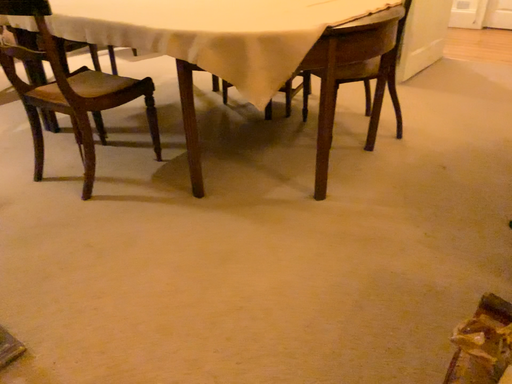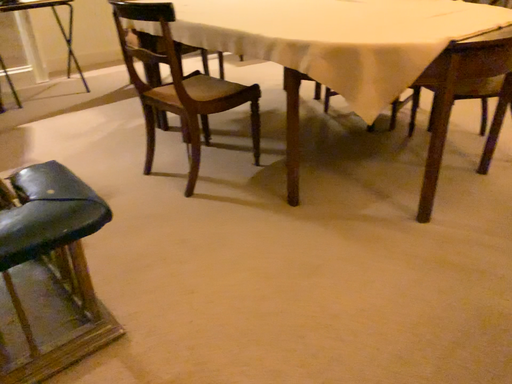
Question: How did the camera likely rotate when shooting the video?

Choices:
 (A) rotated right
 (B) rotated left

Answer: (B)